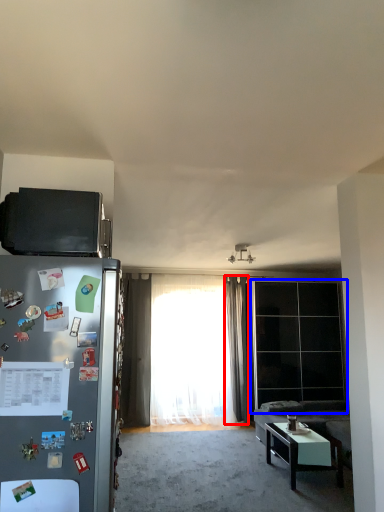
Question: Which point is further to the camera, curtain (highlighted by a red box) or glass door (highlighted by a blue box)?

Choices:
 (A) curtain
 (B) glass door

Answer: (A)